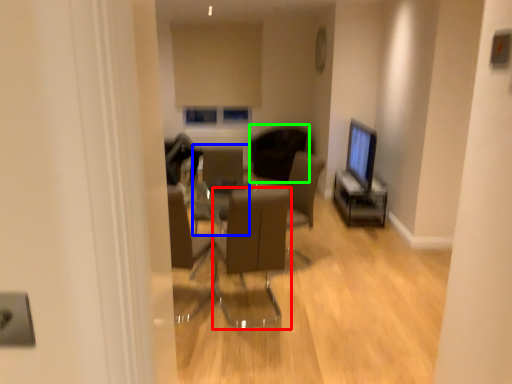
Question: Which is farther away from chair (highlighted by a red box)? armchair (highlighted by a blue box) or chair (highlighted by a green box)?

Choices:
 (A) armchair
 (B) chair

Answer: (B)